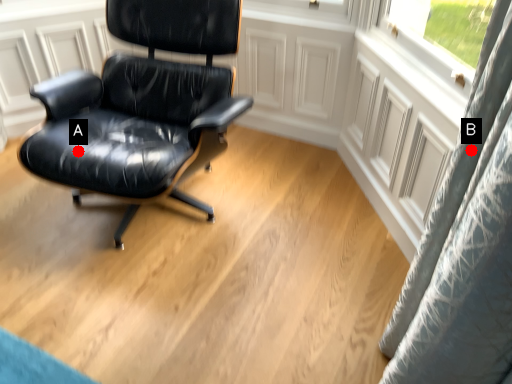
Question: Two points are circled on the image, labeled by A and B beside each circle. Among these points, which one is nearest to the camera?

Choices:
 (A) A is closer
 (B) B is closer

Answer: (B)